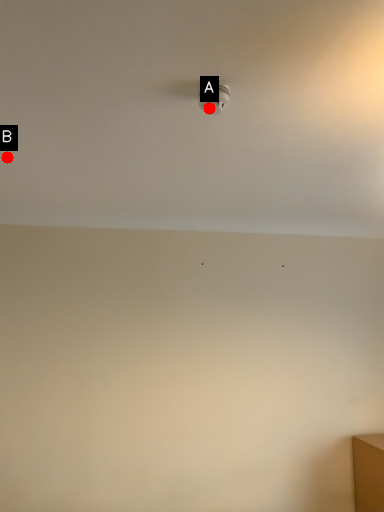
Question: Two points are circled on the image, labeled by A and B beside each circle. Which point is closer to the camera?

Choices:
 (A) A is closer
 (B) B is closer

Answer: (A)